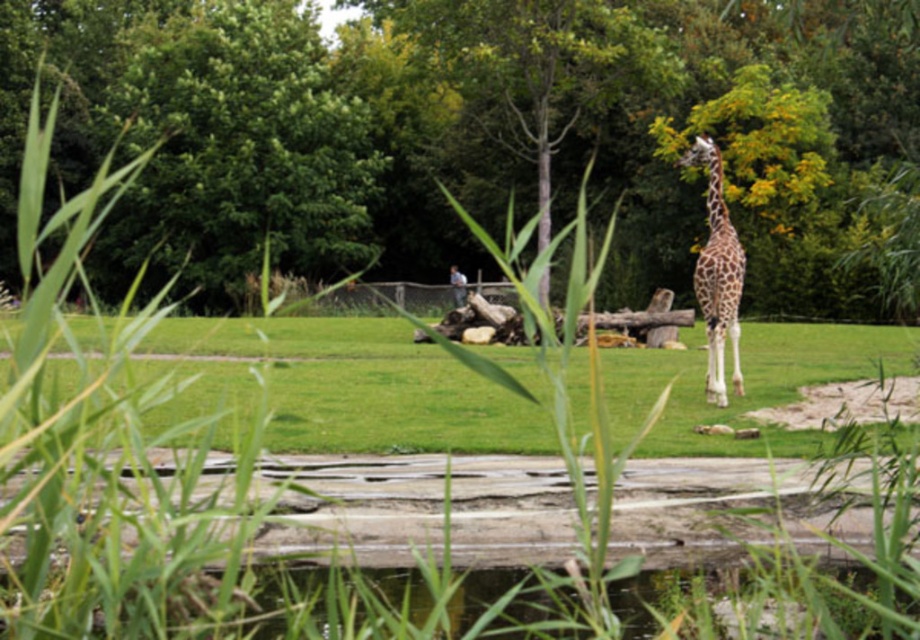
In the scene shown: You are a drone operator trying to capture a photo of the giraffe in the zoo scene. The drone is currently positioned at the green leafy tree at upper left. To get the best shot, you need to move the drone 0.3 units to the right and 0.1 units down from its current position. What is the new coordinate of the drone after this adjustment?

The green leafy tree at upper left is initially at coordinate point (197,138). Moving 0.3 units to the right adds 0.3 to the x coordinate, resulting in 0.517. Moving 0.1 units down adds 0.1 to the y coordinate, resulting in 0.315. The new coordinate is therefore (289,330).